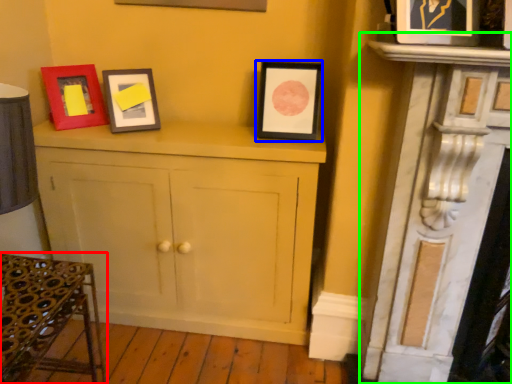
Question: Estimate the real-world distances between objects in this image. Which object is farther from furniture (highlighted by a red box), picture frame (highlighted by a blue box) or fireplace (highlighted by a green box)?

Choices:
 (A) picture frame
 (B) fireplace

Answer: (B)